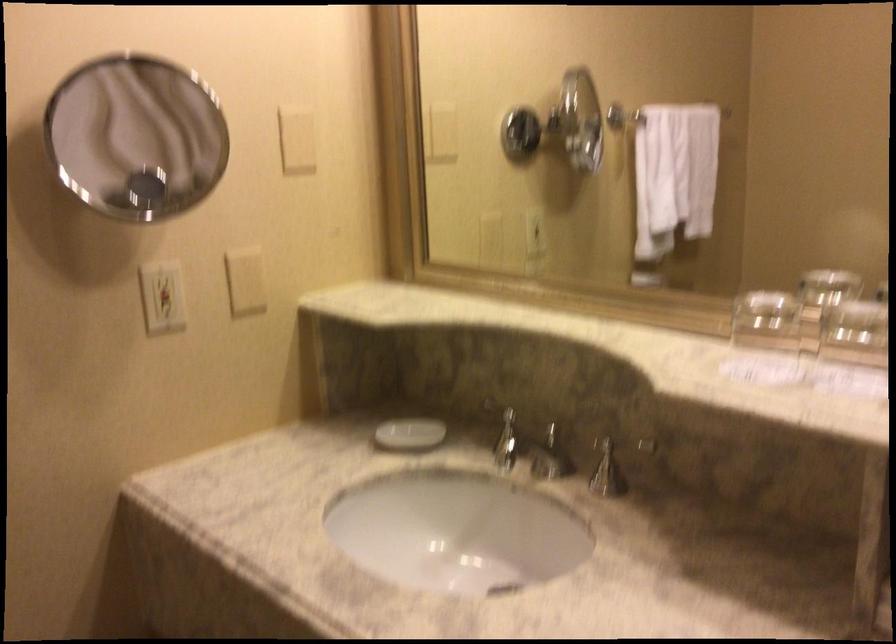
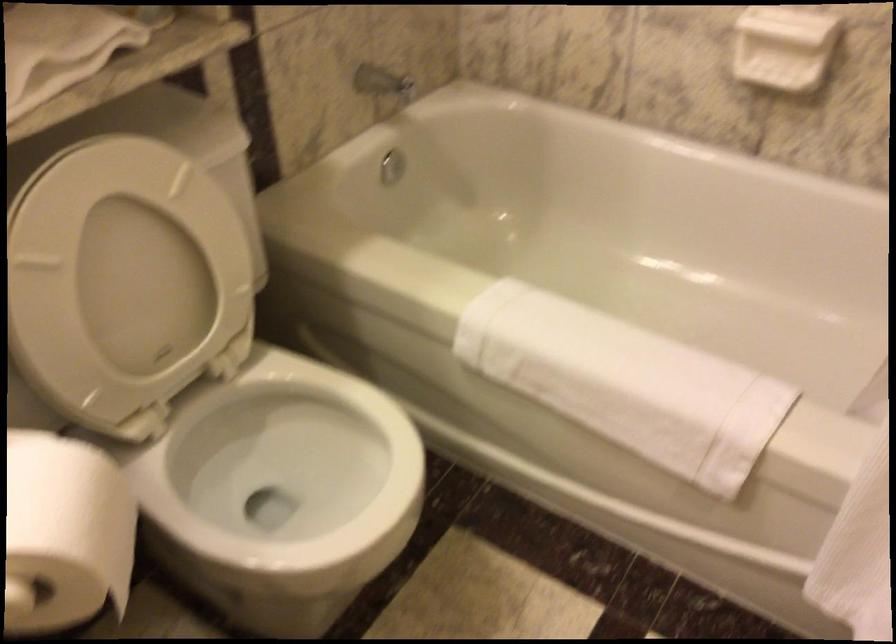
Based on the continuous images, in which direction is the camera rotating?

The camera's rotation is toward right-down.